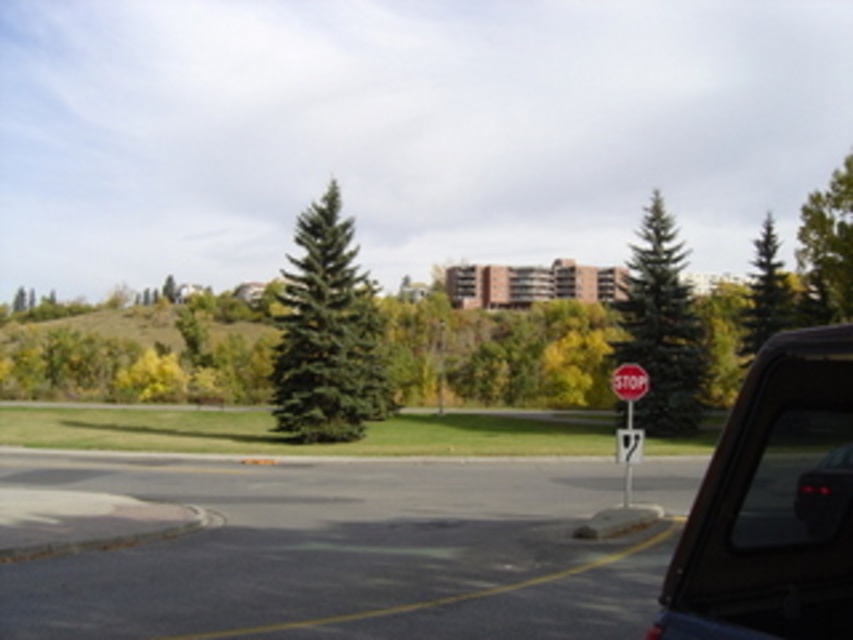
Question: Can you confirm if green matte tree at upper right is positioned below metallic stop sign at right?

Choices:
 (A) yes
 (B) no

Answer: (B)

Question: Is the position of green textured pine tree at right less distant than that of black glossy car at lower right?

Choices:
 (A) no
 (B) yes

Answer: (A)

Question: Which point is closer to the camera?

Choices:
 (A) green matte tree at center
 (B) black glossy car at lower right

Answer: (B)

Question: Is green matte tree at center to the right of metallic stop sign at right from the viewer's perspective?

Choices:
 (A) no
 (B) yes

Answer: (A)

Question: Which point is closer to the camera?

Choices:
 (A) (627, 372)
 (B) (848, 179)
 (C) (320, 333)
 (D) (840, 513)

Answer: (D)

Question: Which of the following is the closest to the observer?

Choices:
 (A) (618, 348)
 (B) (640, 374)
 (C) (283, 406)
 (D) (755, 246)

Answer: (B)